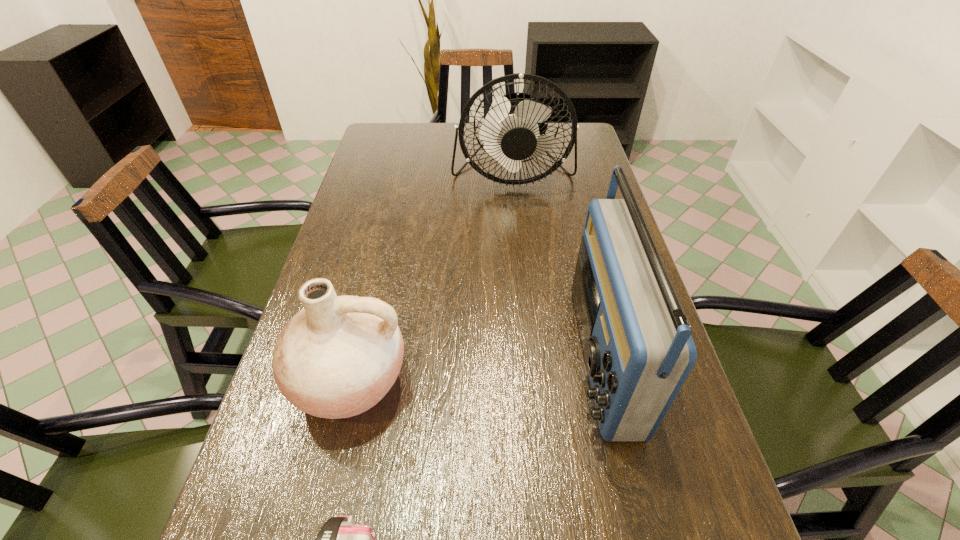
Locate an element on the screen. The height and width of the screenshot is (540, 960). fan is located at coordinates (510, 132).

This screenshot has height=540, width=960. Find the location of `radio receiver`. radio receiver is located at coordinates (638, 350).

I want to click on the second shortest object, so click(x=339, y=356).

You are a GUI agent. You are given a task and a screenshot of the screen. Output one action in this format:
    pyautogui.click(x=<x>, y=<y>)
    Task: Click on the vacant region located 0.110m in front of the fan, directing airflow
    This screenshot has height=540, width=960.
    Given the screenshot: What is the action you would take?
    pyautogui.click(x=517, y=223)

This screenshot has width=960, height=540. What are the coordinates of `free region located 0.050m on the front panel of the radio receiver` in the screenshot? It's located at (551, 356).

Where is `vacant area situated 0.110m on the front panel of the radio receiver`? vacant area situated 0.110m on the front panel of the radio receiver is located at coordinates (522, 356).

You are a GUI agent. You are given a task and a screenshot of the screen. Output one action in this format:
    pyautogui.click(x=<x>, y=<y>)
    Task: Click on the free spot located 0.130m on the front panel of the radio receiver
    
    Given the screenshot: What is the action you would take?
    pyautogui.click(x=513, y=356)

Identify the location of vacant space located to pour from the handle of the pottery. (320, 508).

You are a GUI agent. You are given a task and a screenshot of the screen. Output one action in this format:
    pyautogui.click(x=<x>, y=<y>)
    Task: Click on the object that is at the far edge
    This screenshot has width=960, height=540.
    Given the screenshot: What is the action you would take?
    pyautogui.click(x=510, y=132)

You are a GUI agent. You are given a task and a screenshot of the screen. Output one action in this format:
    pyautogui.click(x=<x>, y=<y>)
    Task: Click on the object at the left edge
    
    Given the screenshot: What is the action you would take?
    pyautogui.click(x=339, y=356)